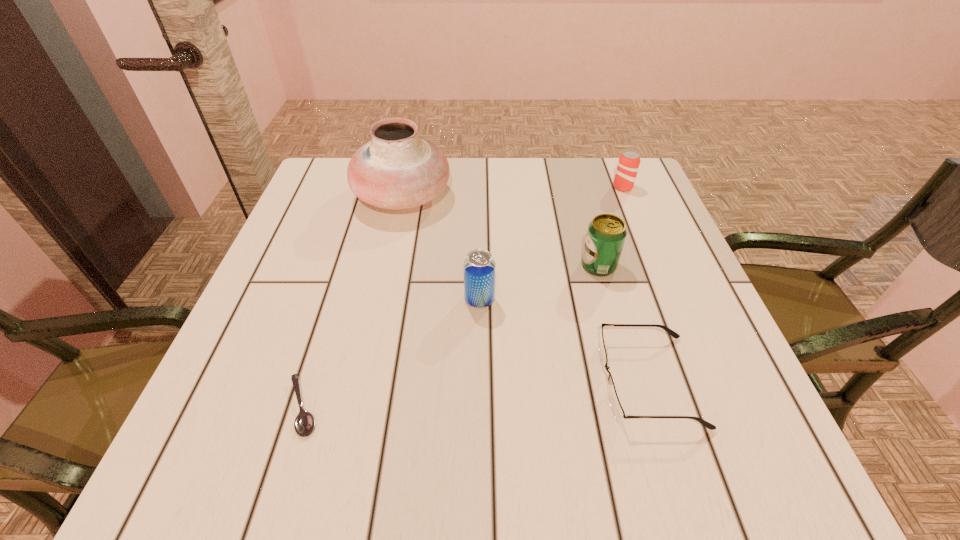
You are a GUI agent. You are given a task and a screenshot of the screen. Output one action in this format:
    pyautogui.click(x=<x>, y=<y>)
    Task: Click on the free location at the left edge
    
    Given the screenshot: What is the action you would take?
    pyautogui.click(x=348, y=241)

Find the location of `vacant space at the right edge of the desktop`. vacant space at the right edge of the desktop is located at coordinates (712, 387).

This screenshot has height=540, width=960. Identify the location of blank space at the far left corner. (333, 207).

Where is `vacant area at the near left corner of the desktop`? This screenshot has width=960, height=540. vacant area at the near left corner of the desktop is located at coordinates (239, 455).

Image resolution: width=960 pixels, height=540 pixels. Identify the location of free region at the far right corner of the desktop. (619, 193).

You are a GUI agent. You are given a task and a screenshot of the screen. Output one action in this format:
    pyautogui.click(x=<x>, y=<y>)
    Task: Click on the vacant area between the fourth nearest object and the pottery
    
    Given the screenshot: What is the action you would take?
    pyautogui.click(x=500, y=231)

Where is `unoccupied position between the third object from left to right and the farthest beer can`? This screenshot has height=540, width=960. unoccupied position between the third object from left to right and the farthest beer can is located at coordinates (551, 244).

Find the location of a particular element. free spot between the pottery and the nearest beer can is located at coordinates (441, 248).

Locate an element on the screen. free space between the tallest object and the second beer can from right to left is located at coordinates (500, 231).

Locate an element on the screen. empty space between the second beer can from left to right and the leftmost beer can is located at coordinates (539, 282).